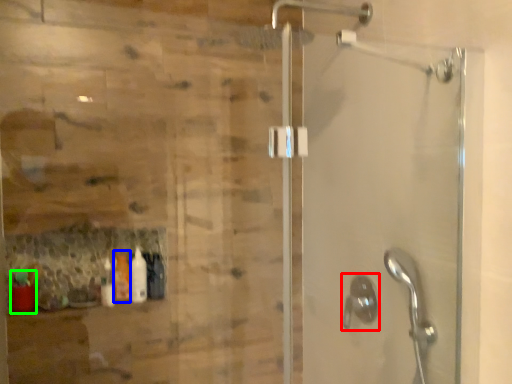
Question: Which is nearer to the shower (highlighted by a red box)? bottle (highlighted by a blue box) or bottle (highlighted by a green box).

Choices:
 (A) bottle
 (B) bottle

Answer: (A)